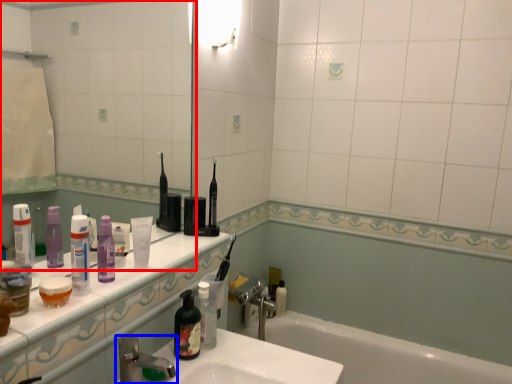
Question: Which object is closer to the camera taking this photo, mirror (highlighted by a red box) or tap (highlighted by a blue box)?

Choices:
 (A) mirror
 (B) tap

Answer: (A)